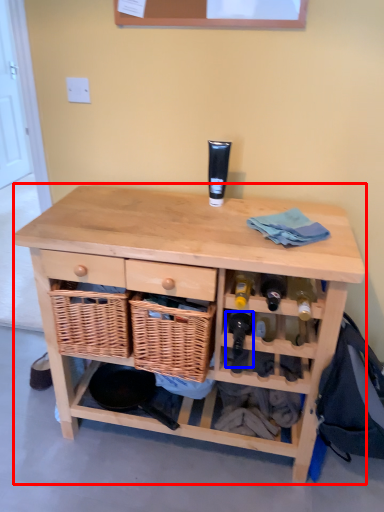
Question: Among these objects, which one is farthest to the camera, table (highlighted by a red box) or wine bottle (highlighted by a blue box)?

Choices:
 (A) table
 (B) wine bottle

Answer: (B)